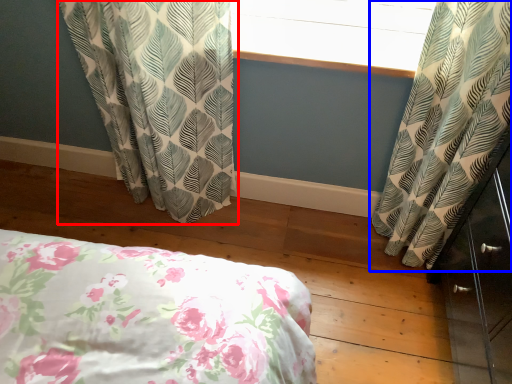
Question: Which object is closer to the camera taking this photo, curtain (highlighted by a red box) or curtain (highlighted by a blue box)?

Choices:
 (A) curtain
 (B) curtain

Answer: (B)